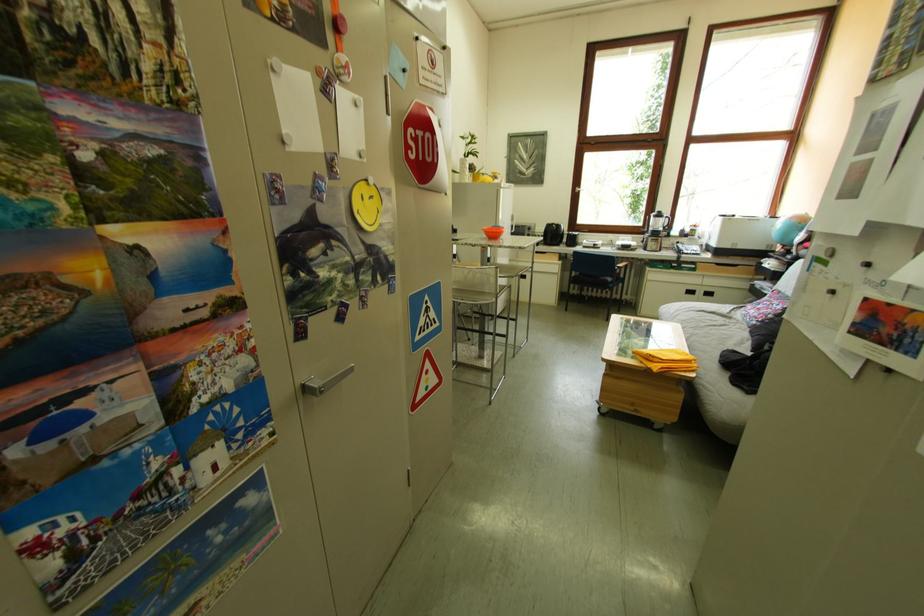
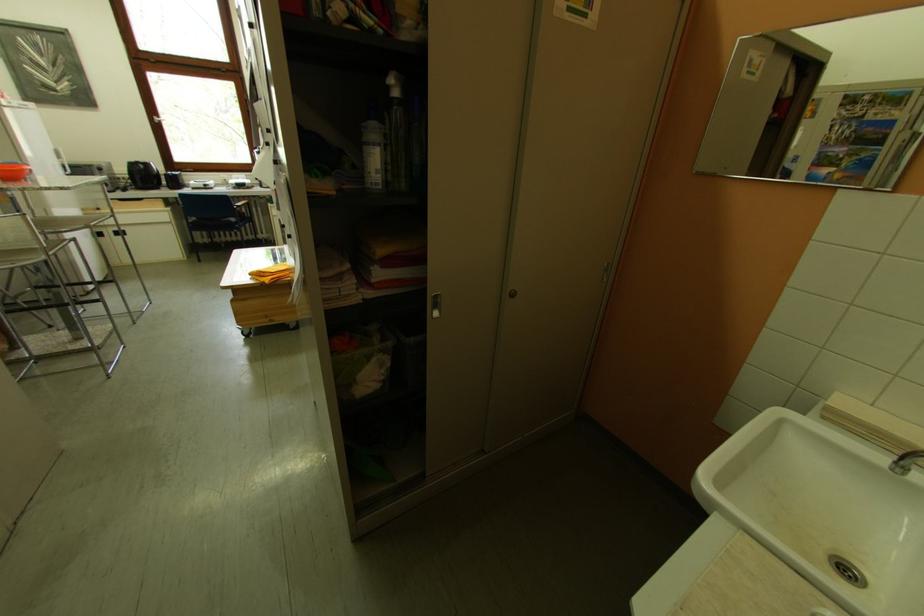
Where in the second image is the point corresponding to point 506,237 from the first image?

(23, 177)